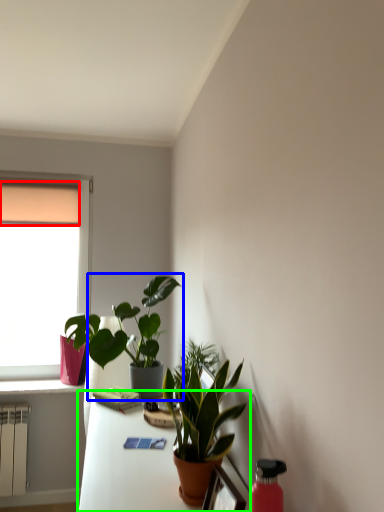
Question: Which is nearer to the curtain (highlighted by a red box)? houseplant (highlighted by a blue box) or table (highlighted by a green box).

Choices:
 (A) houseplant
 (B) table

Answer: (A)